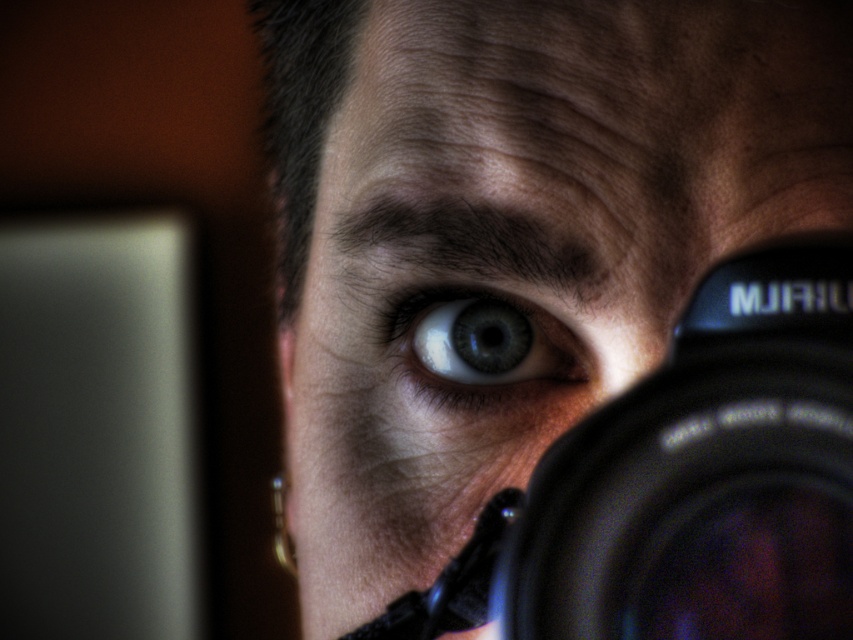
This screenshot has height=640, width=853. What do you see at coordinates (511, 236) in the screenshot?
I see `matte black camera at center` at bounding box center [511, 236].

Which is below, matte black camera at center or blue glossy eye at center?

blue glossy eye at center is below.

Locate an element on the screen. The image size is (853, 640). matte black camera at center is located at coordinates (511, 236).

Between point (793, 289) and point (442, 355), which one is positioned behind?

Point (442, 355)

How far apart are black plastic camera at center and blue glossy eye at center?

black plastic camera at center is 4.36 inches from blue glossy eye at center.

Does point (624, 452) come closer to viewer compared to point (427, 374)?

Yes, it is in front of point (427, 374).

Locate an element on the screen. This screenshot has width=853, height=640. black plastic camera at center is located at coordinates (706, 476).

Between matte black camera at center and black plastic camera at center, which one has more height?

matte black camera at center

Which is above, matte black camera at center or black plastic camera at center?

matte black camera at center

Does point (779, 138) lie in front of point (622, 536)?

No, it is not.

Identify the location of matte black camera at center. (511, 236).